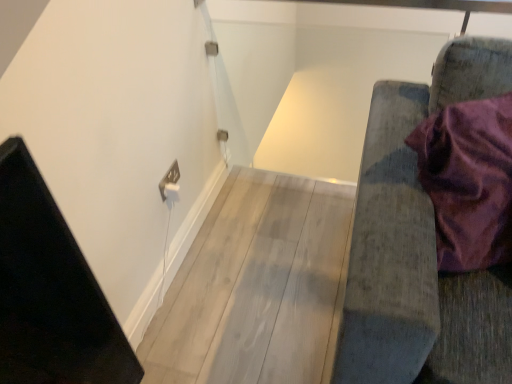
Question: Looking at the image, does white plastic electric outlet at upper left seem bigger or smaller compared to velvet purple cushion at right?

Choices:
 (A) big
 (B) small

Answer: (B)

Question: From the image's perspective, is white plastic electric outlet at upper left positioned above or below velvet purple cushion at right?

Choices:
 (A) above
 (B) below

Answer: (A)

Question: Looking at their shapes, would you say white plastic electric outlet at upper left is wider or thinner than velvet purple cushion at right?

Choices:
 (A) wide
 (B) thin

Answer: (B)

Question: From the image's perspective, is velvet purple cushion at right located above or below white plastic electric outlet at upper left?

Choices:
 (A) above
 (B) below

Answer: (B)

Question: From their relative heights in the image, would you say velvet purple cushion at right is taller or shorter than white plastic electric outlet at upper left?

Choices:
 (A) tall
 (B) short

Answer: (A)

Question: Would you say velvet purple cushion at right is to the left or to the right of white plastic electric outlet at upper left in the picture?

Choices:
 (A) right
 (B) left

Answer: (A)

Question: Is point (487, 324) closer or farther from the camera than point (165, 175)?

Choices:
 (A) closer
 (B) farther

Answer: (A)